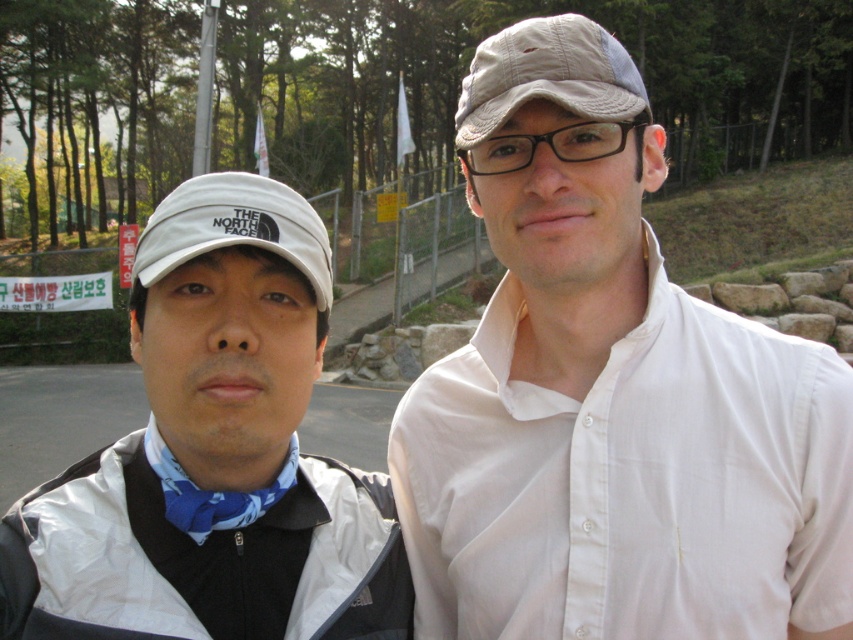
Which is more to the right, white matte shirt at center or blue printed fabric bow tie at center?

From the viewer's perspective, white matte shirt at center appears more on the right side.

Is white matte shirt at center further to the viewer compared to blue printed fabric bow tie at center?

No, white matte shirt at center is in front of blue printed fabric bow tie at center.

Who is more forward, (788,564) or (244,502)?

Point (244,502) is more forward.

Find the location of a particular element. This screenshot has height=640, width=853. white matte shirt at center is located at coordinates (610, 396).

Where is `white fabric cap at left`? The width and height of the screenshot is (853, 640). white fabric cap at left is located at coordinates (213, 452).

Is point (210, 230) farther from camera compared to point (498, 61)?

No, it is in front of (498, 61).

Find the location of `white fabric cap at left`. white fabric cap at left is located at coordinates (x=213, y=452).

Does white matte shirt at center appear on the right side of white fabric baseball hat at left?

Yes, white matte shirt at center is to the right of white fabric baseball hat at left.

Can you confirm if white matte shirt at center is smaller than white fabric baseball hat at left?

Actually, white matte shirt at center might be larger than white fabric baseball hat at left.

Where is `white matte shirt at center`? The width and height of the screenshot is (853, 640). white matte shirt at center is located at coordinates (610, 396).